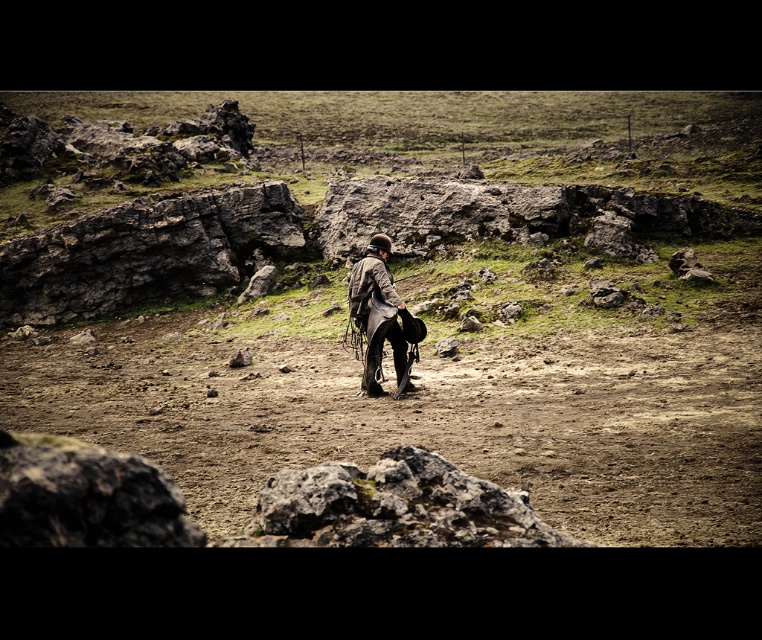
You are an outdoor adventurer planning to cross a rocky terrain. You notice a dull gray rock at center and a leather jacket at center. Which object is positioned to the left when viewed from your perspective?

The dull gray rock at center is located to the left of the leather jacket at center, so the dull gray rock at center is positioned to the left.

You are an outdoor guide assessing the scene. You notice the dull gray rock at center and the leather jacket at center. Which object is bigger in size?

The dull gray rock at center is larger in size compared to the leather jacket at center.